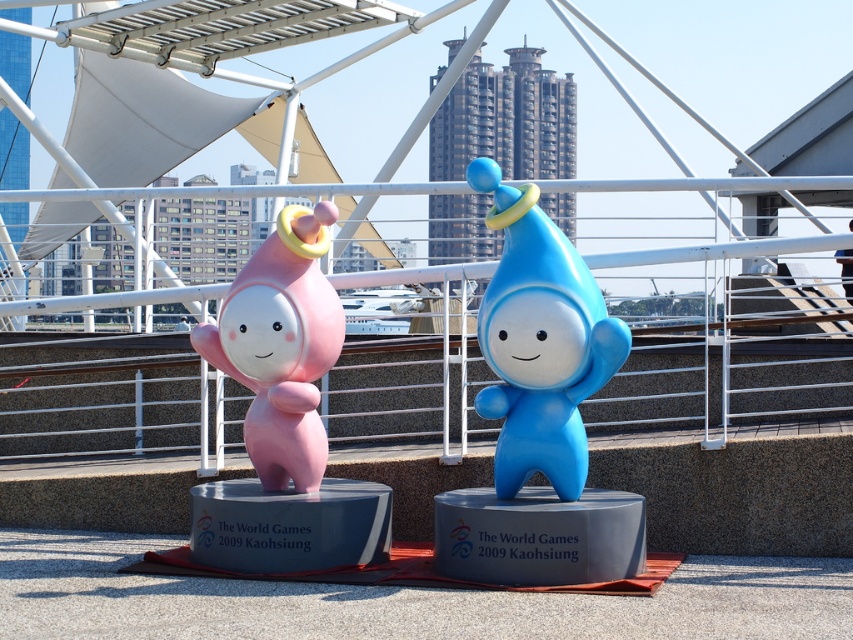
You are a child visiting the statues and want to know which one is bigger. Based on the scene, can you tell me which object is larger between the blue glossy toy at center and the matte pink figure at left?

The blue glossy toy at center is larger in size compared to the matte pink figure at left according to the description.

You are standing at the center of the paved area where the two statues are located. You notice a point marked at coordinates (x=540, y=340). Which object is located at this point?

The point at coordinates (x=540, y=340) corresponds to the blue glossy toy at center.

You are standing at the center of the paved area where the two statues are located. There are two points marked on the ground labeled as point 1 and point 2. Point 1 is at coordinates point [575,253] and point 2 is at point [273,456]. If you want to place a new statue between them such that it is closer to the point that is in front of the other, which point should it be closer to?

Point 1 is in front of point 2, so the new statue should be placed closer to point 2 since it is behind point 1.